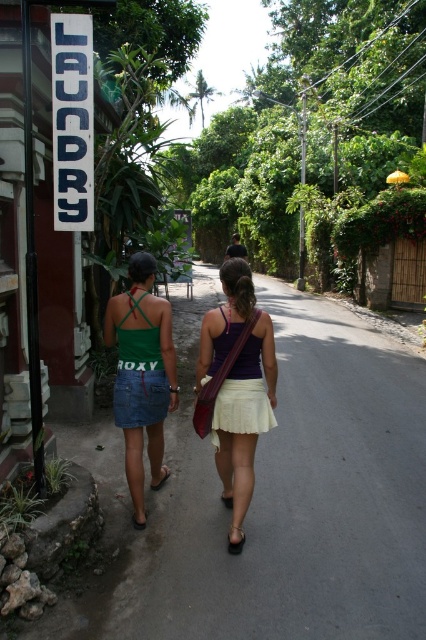
Is the position of matte purple tank top at center more distant than that of green denim skirt at center?

No, it is not.

How far apart are matte purple tank top at center and green denim skirt at center?

A distance of 22.11 inches exists between matte purple tank top at center and green denim skirt at center.

Locate an element on the screen. This screenshot has width=426, height=640. matte purple tank top at center is located at coordinates (236, 388).